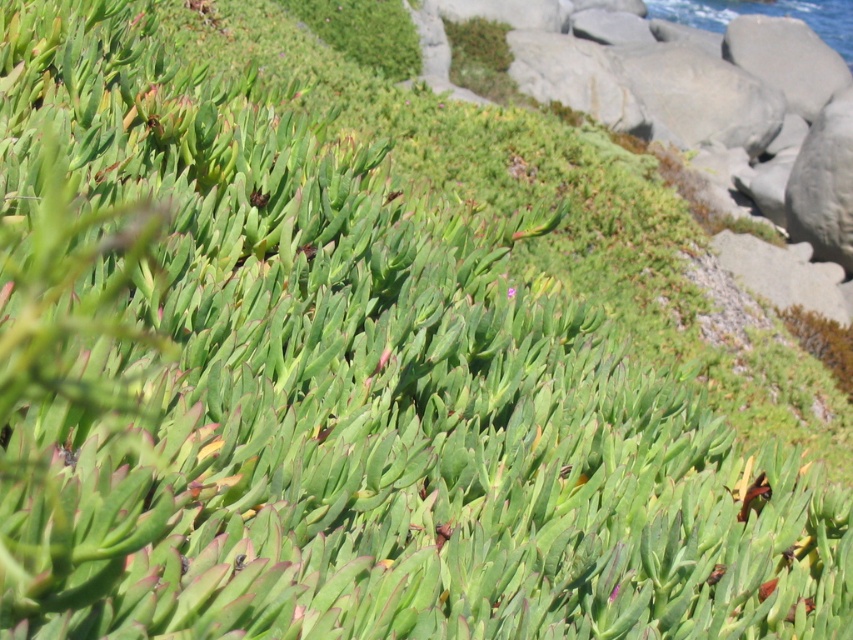
From the picture: Does blue water at upper right appear on the right side of green succulent at center?

Correct, you'll find blue water at upper right to the right of green succulent at center.

Measure the distance between blue water at upper right and green succulent at center.

The distance of blue water at upper right from green succulent at center is 107.30 feet.

Is point (770, 4) more distant than point (509, 296)?

Yes, it is.

You are a GUI agent. You are given a task and a screenshot of the screen. Output one action in this format:
    pyautogui.click(x=<x>, y=<y>)
    Task: Click on the blue water at upper right
    
    Given the screenshot: What is the action you would take?
    pyautogui.click(x=763, y=13)